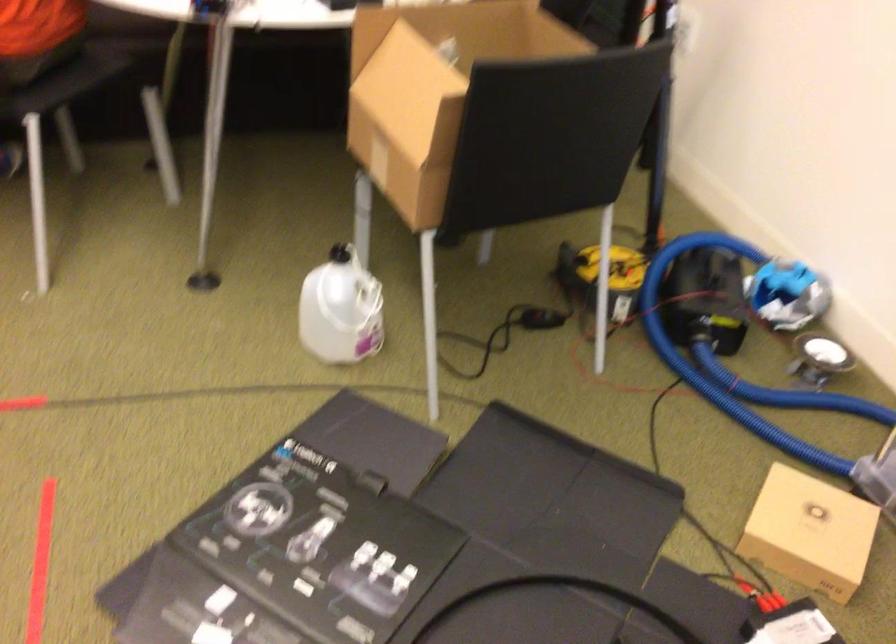
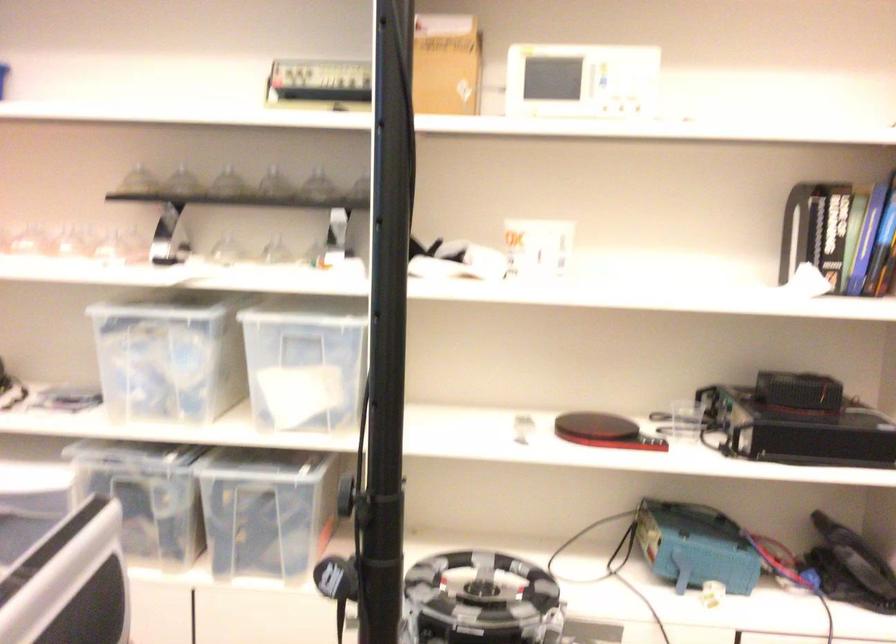
Question: The camera is either moving clockwise (left) or counter-clockwise (right) around the object. The first image is from the beginning of the video and the second image is from the end. Is the camera moving left or right when shooting the video?

Choices:
 (A) Left
 (B) Right

Answer: (B)